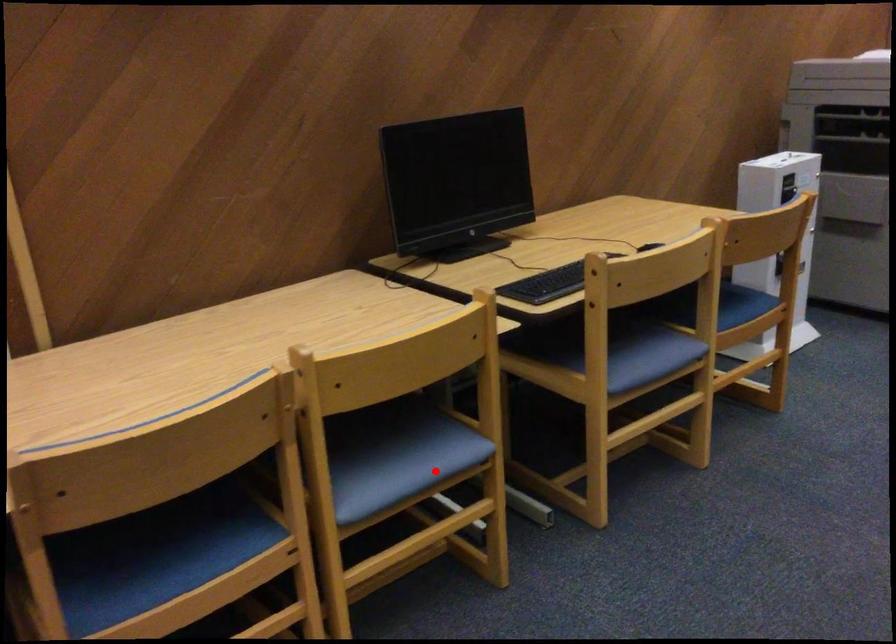
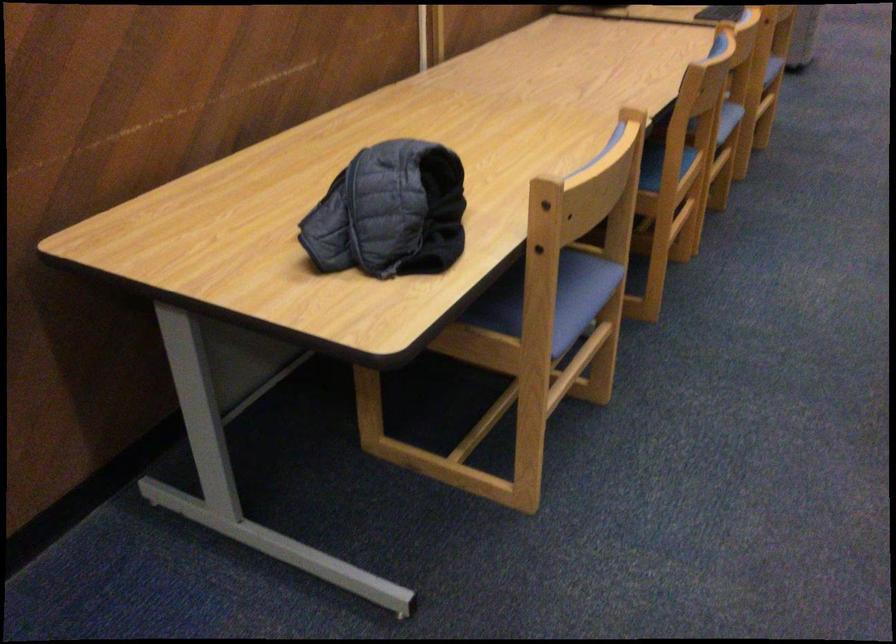
Question: A red point is marked in image1. In image2, is the corresponding 3D point closer to the camera or farther? Reply with the corresponding letter.

Choices:
 (A) The corresponding 3D point is closer.
 (B) The corresponding 3D point is farther.

Answer: (B)